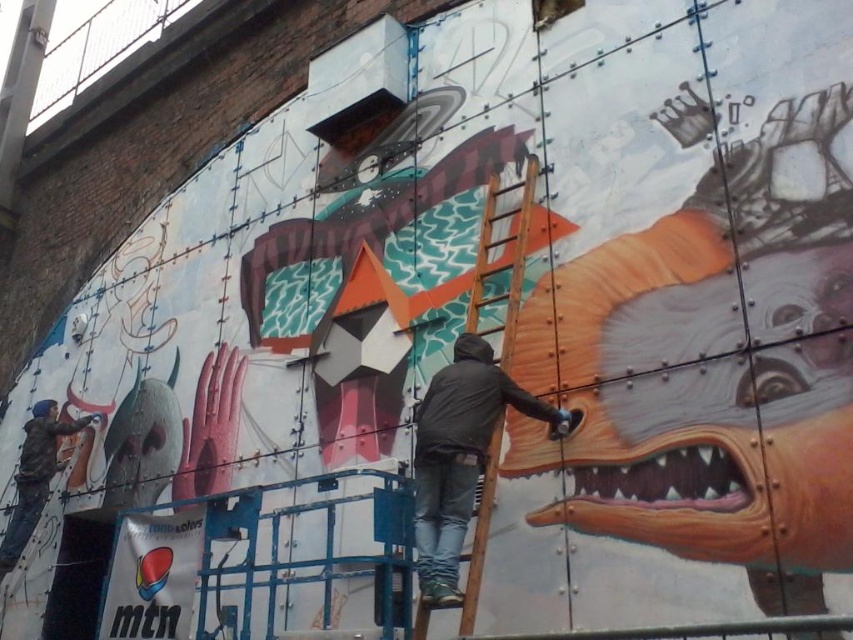
Question: Based on their relative distances, which object is farther from the wooden ladder at center?

Choices:
 (A) dark gray jacket at center
 (B) matte black jacket at left

Answer: (B)

Question: Is wooden ladder at center below matte black jacket at left?

Choices:
 (A) yes
 (B) no

Answer: (B)

Question: Which of the following is the closest to the observer?

Choices:
 (A) (32, 440)
 (B) (537, 172)
 (C) (466, 390)

Answer: (C)

Question: Which point appears farthest from the camera in this image?

Choices:
 (A) (33, 452)
 (B) (509, 349)
 (C) (439, 435)

Answer: (A)

Question: Can you confirm if dark gray jacket at center is thinner than wooden ladder at center?

Choices:
 (A) yes
 (B) no

Answer: (B)

Question: Does dark gray jacket at center appear on the right side of wooden ladder at center?

Choices:
 (A) no
 (B) yes

Answer: (B)